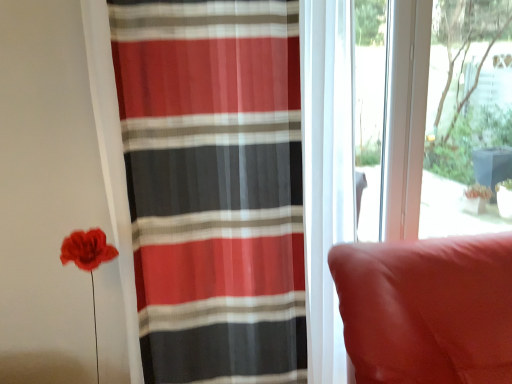
Question: From the image's perspective, is suede-like red cushion at right located above or below striped sheer curtain at left?

Choices:
 (A) above
 (B) below

Answer: (B)

Question: From a real-world perspective, is suede-like red cushion at right physically located above or below striped sheer curtain at left?

Choices:
 (A) above
 (B) below

Answer: (B)

Question: Which is nearer to the striped sheer curtain at left?

Choices:
 (A) suede-like red cushion at right
 (B) transparent glass window screen at upper right

Answer: (A)

Question: Which object is the closest to the suede-like red cushion at right?

Choices:
 (A) striped sheer curtain at left
 (B) transparent glass window screen at upper right

Answer: (A)